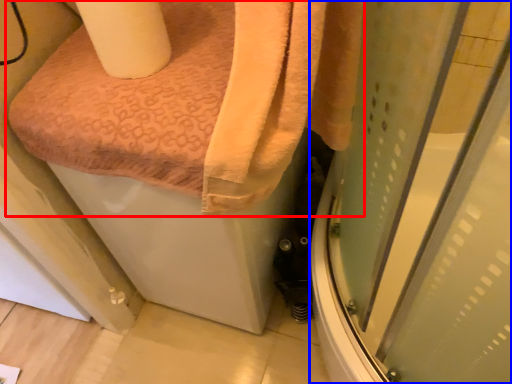
Question: Which of the following is the closest to the observer, towel (highlighted by a red box) or screen door (highlighted by a blue box)?

Choices:
 (A) towel
 (B) screen door

Answer: (B)